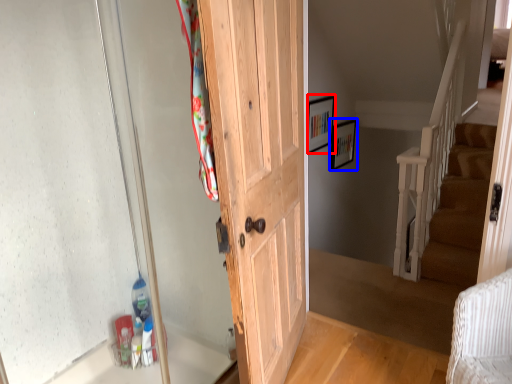
Question: Which of the following is the closest to the observer, picture frame (highlighted by a red box) or picture frame (highlighted by a blue box)?

Choices:
 (A) picture frame
 (B) picture frame

Answer: (A)